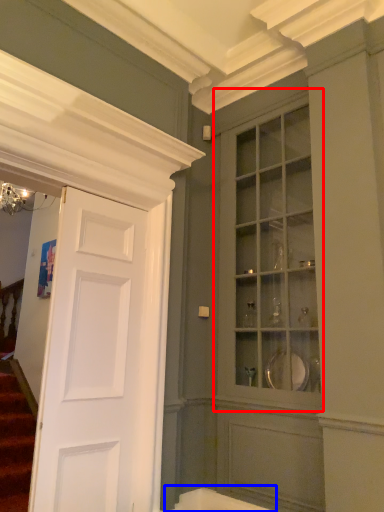
Question: Which point is closer to the camera, cabinetry (highlighted by a red box) or bath (highlighted by a blue box)?

Choices:
 (A) cabinetry
 (B) bath

Answer: (A)